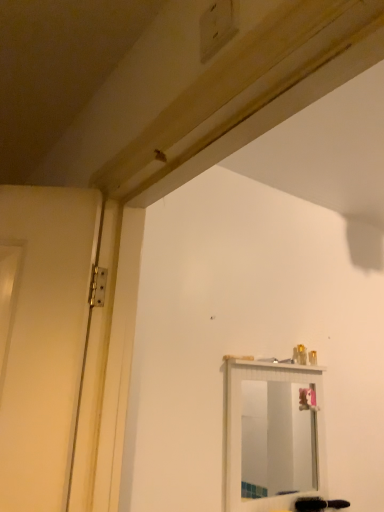
This screenshot has height=512, width=384. In order to click on white glossy mirror at lower right in this screenshot , I will do `click(276, 441)`.

In the scene shown: In order to face white glossy mirror at lower right, should I rotate leftwards or rightwards?

You should look right and rotate roughly 11.669 degrees.

What do you see at coordinates (276, 441) in the screenshot?
I see `white glossy mirror at lower right` at bounding box center [276, 441].

Find the location of a particular element. white glossy mirror at lower right is located at coordinates (276, 441).